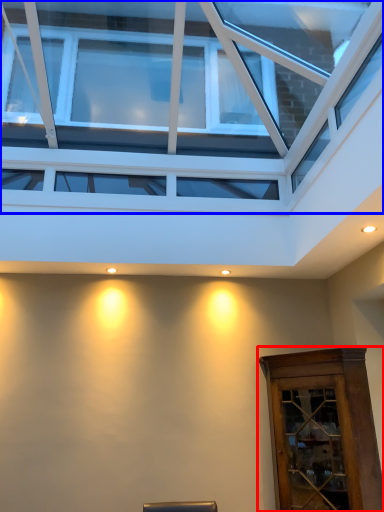
Question: Among these objects, which one is nearest to the camera, elevator (highlighted by a red box) or window (highlighted by a blue box)?

Choices:
 (A) elevator
 (B) window

Answer: (B)